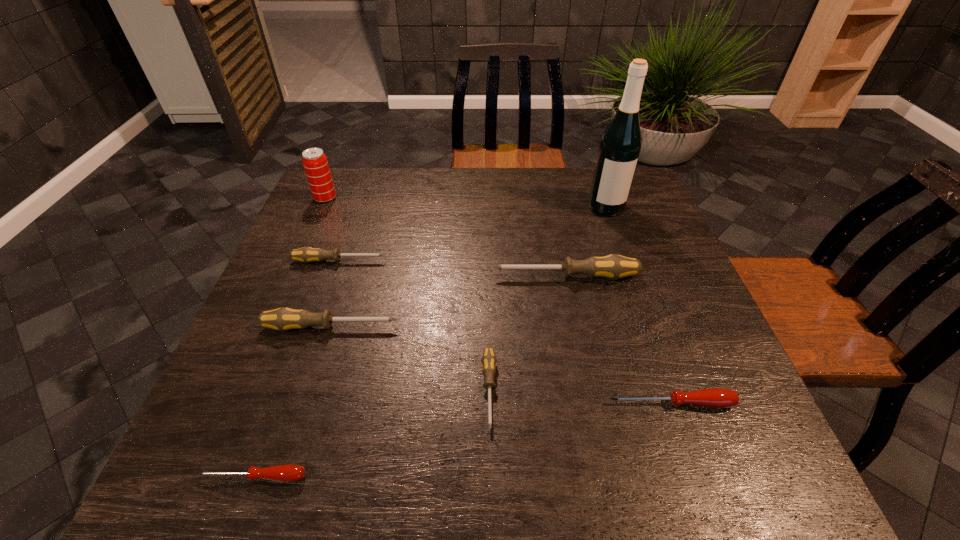
The image size is (960, 540). Find the location of `unoccupied position between the soda can and the fourth farthest object`. unoccupied position between the soda can and the fourth farthest object is located at coordinates (445, 238).

Find the location of a particular element. empty space between the second tallest screwdriver and the third farthest object is located at coordinates (335, 294).

Locate an element on the screen. The image size is (960, 540). free point between the second biggest gray screwdriver and the soda can is located at coordinates (328, 263).

The image size is (960, 540). I want to click on vacant area that lies between the smallest gray screwdriver and the left red screwdriver, so click(372, 434).

The height and width of the screenshot is (540, 960). What are the coordinates of `vacant area between the dark wine bottle and the farthest screwdriver` in the screenshot? It's located at (472, 234).

Where is `free spot between the fourth farthest object and the seventh shortest object`? The height and width of the screenshot is (540, 960). free spot between the fourth farthest object and the seventh shortest object is located at coordinates [445, 238].

Locate an element on the screen. free space that is in between the dark wine bottle and the bigger red screwdriver is located at coordinates (638, 305).

You are a GUI agent. You are given a task and a screenshot of the screen. Output one action in this format:
    pyautogui.click(x=<x>, y=<y>)
    Task: Click on the object that is the fourth closest to the fourth farthest object
    The width and height of the screenshot is (960, 540).
    Given the screenshot: What is the action you would take?
    pyautogui.click(x=306, y=254)

Find the location of `object identified as the seventh closest to the farther red screwdriver`. object identified as the seventh closest to the farther red screwdriver is located at coordinates (315, 163).

Identify which screwdriver is the third closest to the bigger red screwdriver. Please provide its 2D coordinates. Your answer should be formatted as a tuple, i.e. [(x, y)], where the tuple contains the x and y coordinates of a point satisfying the conditions above.

[(283, 319)]